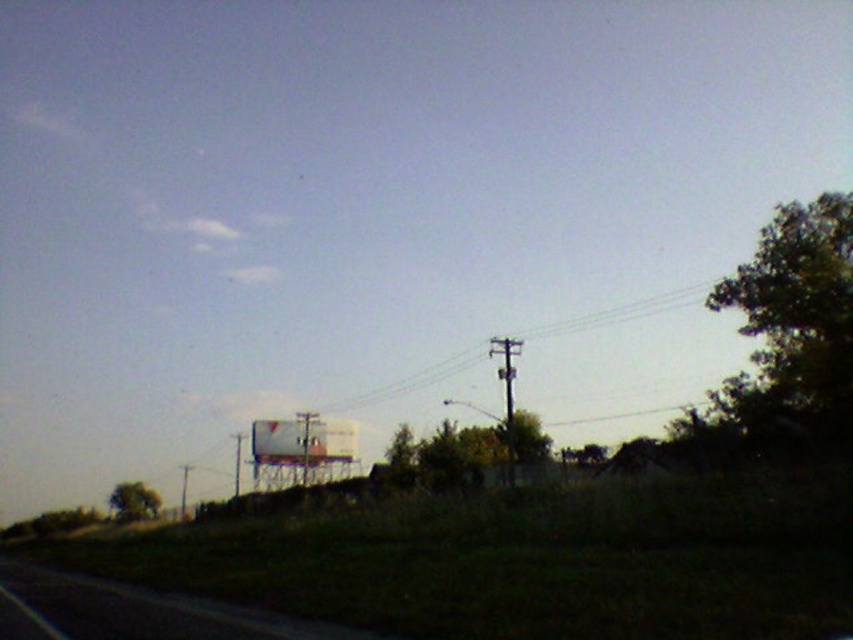
Question: Is metallic wire at center smaller than smooth wooden pole at center right?

Choices:
 (A) yes
 (B) no

Answer: (B)

Question: Which object is closer to the camera taking this photo?

Choices:
 (A) smooth wooden pole at center right
 (B) metallic wire at center

Answer: (A)

Question: Which of the following is the closest to the observer?

Choices:
 (A) asphalt road at lower left
 (B) metallic wire at center

Answer: (A)

Question: Is asphalt road at lower left above metallic wire at center?

Choices:
 (A) no
 (B) yes

Answer: (A)

Question: Which point is closer to the camera?

Choices:
 (A) smooth wooden pole at center right
 (B) metallic wire at center
 (C) asphalt road at lower left

Answer: (C)

Question: In this image, where is metallic wire at center located relative to smooth wooden pole at center right?

Choices:
 (A) left
 (B) right

Answer: (A)